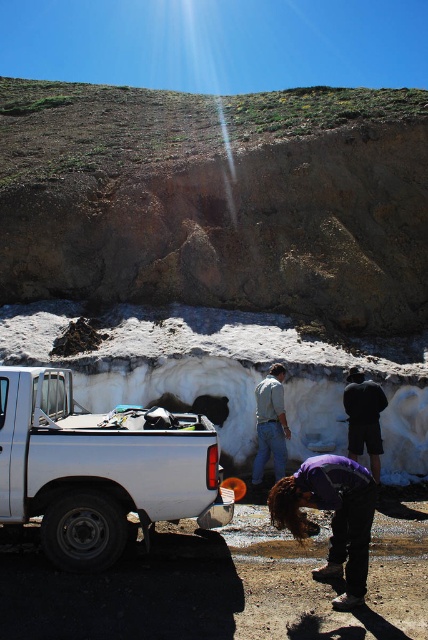
Does brown rough rock at upper center lie in front of dark blue fabric at center?

No, it is not.

Which is in front, point (83, 179) or point (342, 394)?

Positioned in front is point (342, 394).

Locate an element on the screen. brown rough rock at upper center is located at coordinates (217, 198).

The image size is (428, 640). I want to click on brown rough rock at upper center, so click(217, 198).

Is purple fabric at lower center to the left of light gray cotton shirt at center from the viewer's perspective?

Incorrect, purple fabric at lower center is not on the left side of light gray cotton shirt at center.

Does purple fabric at lower center have a lesser width compared to light gray cotton shirt at center?

No, purple fabric at lower center is not thinner than light gray cotton shirt at center.

The height and width of the screenshot is (640, 428). What do you see at coordinates (332, 516) in the screenshot? I see `purple fabric at lower center` at bounding box center [332, 516].

The width and height of the screenshot is (428, 640). I want to click on purple fabric at lower center, so click(332, 516).

Is purple fabric at lower center to the left of dark blue fabric at center from the viewer's perspective?

Indeed, purple fabric at lower center is positioned on the left side of dark blue fabric at center.

Is purple fabric at lower center behind dark blue fabric at center?

No.

Between point (341, 476) and point (379, 460), which one is positioned behind?

The point (379, 460) is behind.

Identify the location of purple fabric at lower center. The width and height of the screenshot is (428, 640). (332, 516).